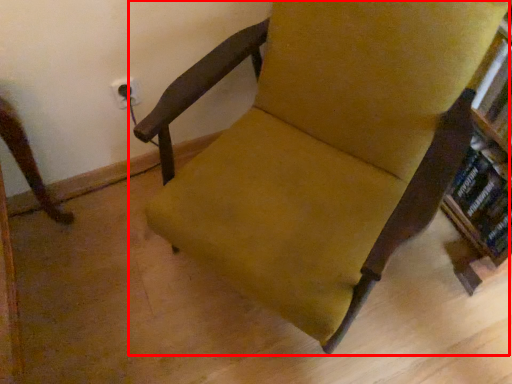
Question: In this image, where is chair (annotated by the red box) located relative to book?

Choices:
 (A) left
 (B) right

Answer: (A)